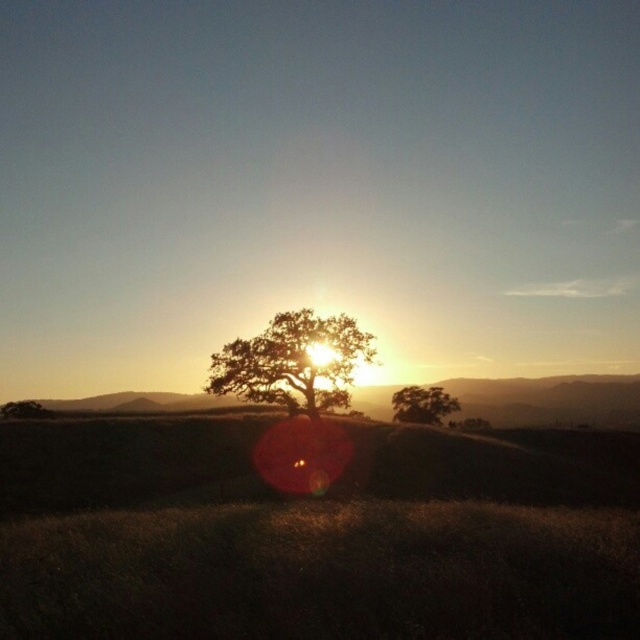
You are an artist planning to paint the sunset scene. You want to ensure the silvery textured tree at center and the brown matte tree at lower left are proportionally accurate. Which tree should you make smaller in your painting?

The silvery textured tree at center occupies less space than the brown matte tree at lower left, so you should make the silvery textured tree at center smaller than the brown matte tree at lower left in your painting.

You are a hiker who wants to take a photo of the green matte tree at center and the brown matte tree at lower left. You have a camera with a 50mm lens. Knowing that a 50mm lens has a field of view of about 46 degrees, can you estimate if both trees will fit in the frame if you stand exactly halfway between them?

The green matte tree at center and brown matte tree at lower left are 41.01 meters apart. To determine if both trees will fit in the frame with a 50mm lens, we can calculate the angle between them from your position halfway between them. The distance from you to each tree would be half of 41.01 meters, which is approximately 20.5 meters. Using the formula for angular size, the angle between the two trees would be 2 times the arctangent of half the distance between them divided by the distance from the lens.

You are an artist painting this sunset scene. You need to paint the green matte tree at center and the brown matte tree at lower left. According to the scene, which tree should you paint first to ensure proper layering?

The green matte tree at center should be painted first because it is positioned over the brown matte tree at lower left, meaning it should be layered on top to maintain the correct spatial relationship.